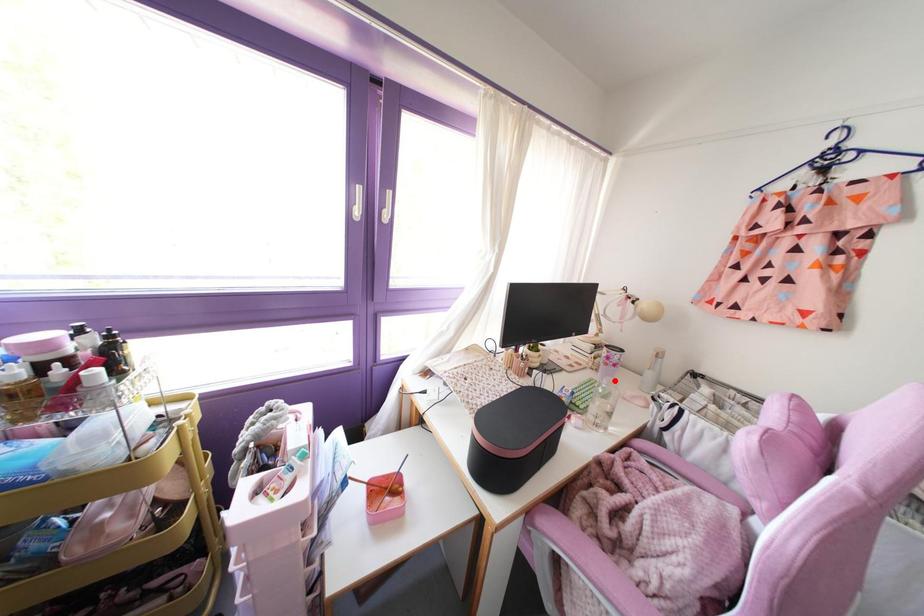
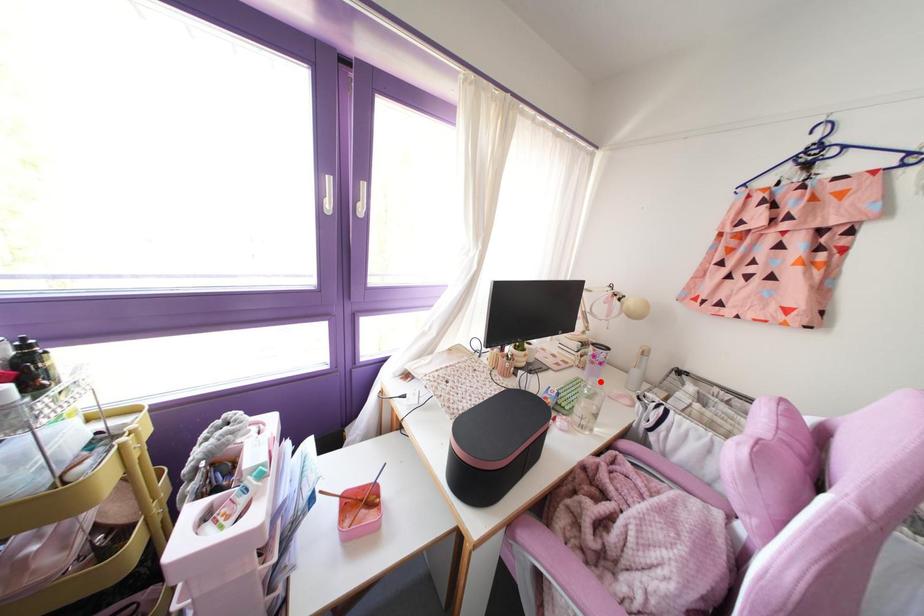
I am providing you with two images of the same scene from different viewpoints. A red point is marked on the first image and another point is marked on the second image. Are the points marked in image1 and image2 representing the same 3D position?

Yes